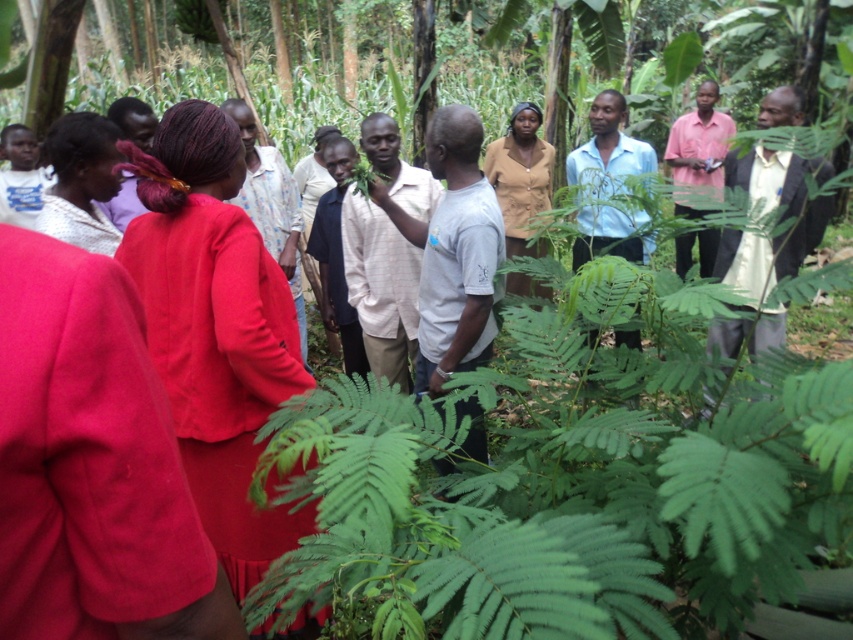
You are a photographer trying to capture a group photo of the matte brown shirt at center and the pink matte shirt at right. Since you want both subjects to appear equally tall in the photo, which subject should you position closer to the camera?

To make both the matte brown shirt at center and the pink matte shirt at right appear equally tall in the photo, you should position the matte brown shirt at center closer to the camera because it is much taller than the pink matte shirt at right.

You are a photographer trying to capture a group photo of the matte red dress at center and the light pink shirt at right. Which clothing item should you focus on first if you want to ensure both are in frame and properly sized?

The matte red dress at center is smaller than the light pink shirt at right, so you should focus on the light pink shirt at right first to ensure proper sizing in the frame.

You are standing in the forest and see two people wearing the matte red dress at center and the matte brown shirt at center. Which one is nearer to you?

The matte red dress at center is closer to the viewer than the matte brown shirt at center, so the person wearing the matte red dress at center is nearer to you.